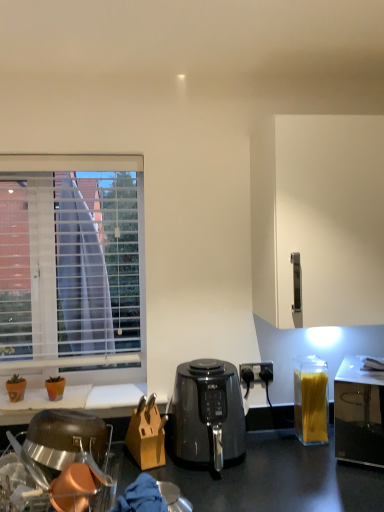
Question: Relative to white matte cabinet at right, is transparent plastic container of spaghetti at right in front or behind?

Choices:
 (A) front
 (B) behind

Answer: (A)

Question: From a real-world perspective, relative to white matte cabinet at right, is transparent plastic container of spaghetti at right vertically above or below?

Choices:
 (A) above
 (B) below

Answer: (B)

Question: Which object is positioned closest to the black plastic air fryer at center?

Choices:
 (A) stainless steel dish rack at lower left
 (B) white matte cabinet at right
 (C) white matte desk at lower left
 (D) white blinds at left
 (E) wooden knife block at center

Answer: (E)

Question: Which is farther from the translucent plastic container of spaghetti at right?

Choices:
 (A) wooden knife block at center
 (B) white matte desk at lower left
 (C) white matte cabinet at right
 (D) black plastic air fryer at center
 (E) white blinds at left

Answer: (E)